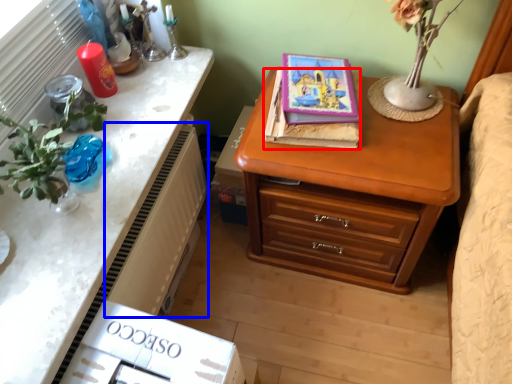
Question: Which object appears closest to the camera in this image, book (highlighted by a red box) or radiator (highlighted by a blue box)?

Choices:
 (A) book
 (B) radiator

Answer: (B)